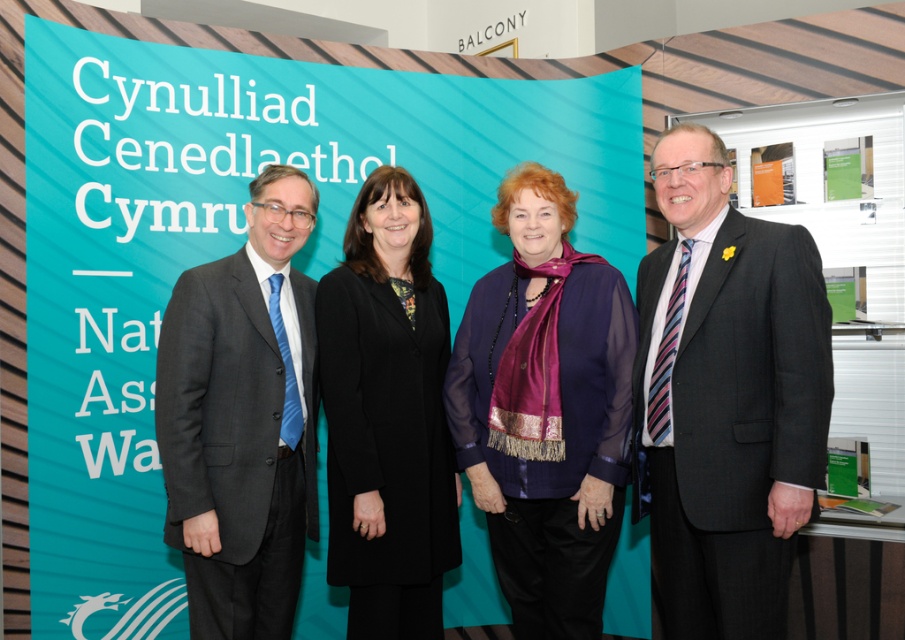
You are attending an official event and notice the teal fabric banner at upper center and the dark gray suit at left. Which object is wider from the perspective of someone standing in front of the backdrop?

The teal fabric banner at upper center might be wider than dark gray suit at left according to the description.

You are an event organizer and need to arrange a photo shoot. You have to place a purple silk scarf at center and a black wool coat at center in the image. Considering their widths, which item should you position to the left to ensure there is enough space between them?

The purple silk scarf at center might be wider than black wool coat at center, so positioning the wider purple silk scarf at center to the left would allow sufficient space between them.

You are attending an official event and notice two items in the scene described. The first is the teal fabric banner at upper center, and the second is the dark gray suit at right. Based on their sizes, which item occupies more space in the image?

The teal fabric banner at upper center has a larger size compared to the dark gray suit at right, so it occupies more space in the image.